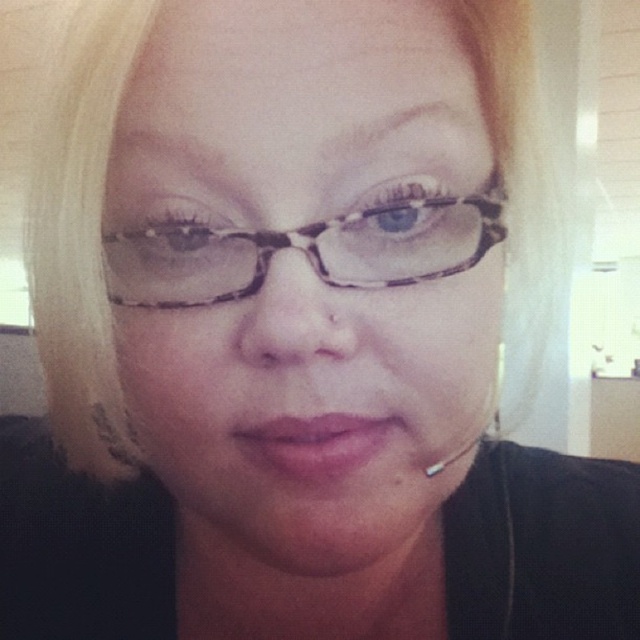
You are a photographer adjusting the lighting for a portrait. You notice two pairs of glasses on the subject, the matte black glasses at center and the translucent tortoiseshell glasses at center. Which pair is positioned lower on the face?

The matte black glasses at center is below the translucent tortoiseshell glasses at center, so the matte black glasses at center is positioned lower on the face.

Looking at the person in the image, which glasses are positioned to the left between the matte black glasses at center and the translucent tortoiseshell glasses at center?

The matte black glasses at center are positioned to the left of the translucent tortoiseshell glasses at center.